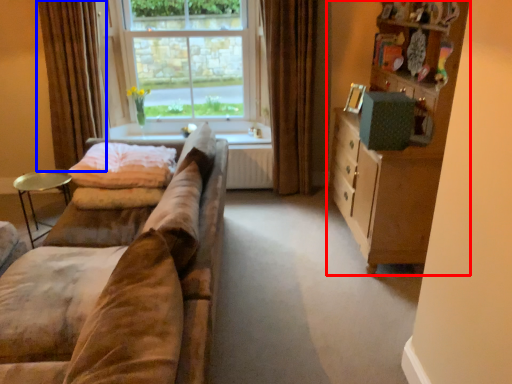
Question: Among these objects, which one is farthest to the camera, cabinetry (highlighted by a red box) or curtain (highlighted by a blue box)?

Choices:
 (A) cabinetry
 (B) curtain

Answer: (B)